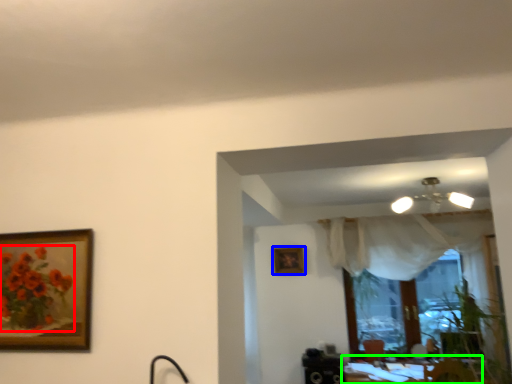
Question: Considering the real-world distances, which object is closest to flower (highlighted by a red box)? picture frame (highlighted by a blue box) or table (highlighted by a green box).

Choices:
 (A) picture frame
 (B) table

Answer: (A)